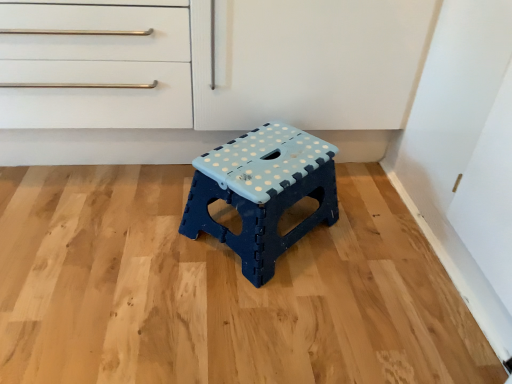
Question: Does blue plastic stool at center have a lesser width compared to light brown wood at center?

Choices:
 (A) yes
 (B) no

Answer: (A)

Question: Is blue plastic stool at center not inside light brown wood at center?

Choices:
 (A) no
 (B) yes

Answer: (B)

Question: From a real-world perspective, is blue plastic stool at center physically below light brown wood at center?

Choices:
 (A) yes
 (B) no

Answer: (B)

Question: Is blue plastic stool at center looking in the opposite direction of light brown wood at center?

Choices:
 (A) no
 (B) yes

Answer: (A)

Question: Does blue plastic stool at center turn towards light brown wood at center?

Choices:
 (A) yes
 (B) no

Answer: (B)

Question: Does blue plastic stool at center appear on the right side of light brown wood at center?

Choices:
 (A) yes
 (B) no

Answer: (A)

Question: Is light brown wood at center in front of blue plastic stool at center?

Choices:
 (A) yes
 (B) no

Answer: (A)

Question: From the image's perspective, is light brown wood at center above blue plastic stool at center?

Choices:
 (A) no
 (B) yes

Answer: (A)

Question: Is light brown wood at center in contact with blue plastic stool at center?

Choices:
 (A) no
 (B) yes

Answer: (A)

Question: From a real-world perspective, does light brown wood at center sit lower than blue plastic stool at center?

Choices:
 (A) no
 (B) yes

Answer: (B)

Question: Is light brown wood at center smaller than blue plastic stool at center?

Choices:
 (A) no
 (B) yes

Answer: (A)

Question: Considering the relative sizes of light brown wood at center and blue plastic stool at center in the image provided, is light brown wood at center shorter than blue plastic stool at center?

Choices:
 (A) no
 (B) yes

Answer: (B)

Question: Choose the correct answer: Is light brown wood at center inside blue plastic stool at center or outside it?

Choices:
 (A) inside
 (B) outside

Answer: (B)